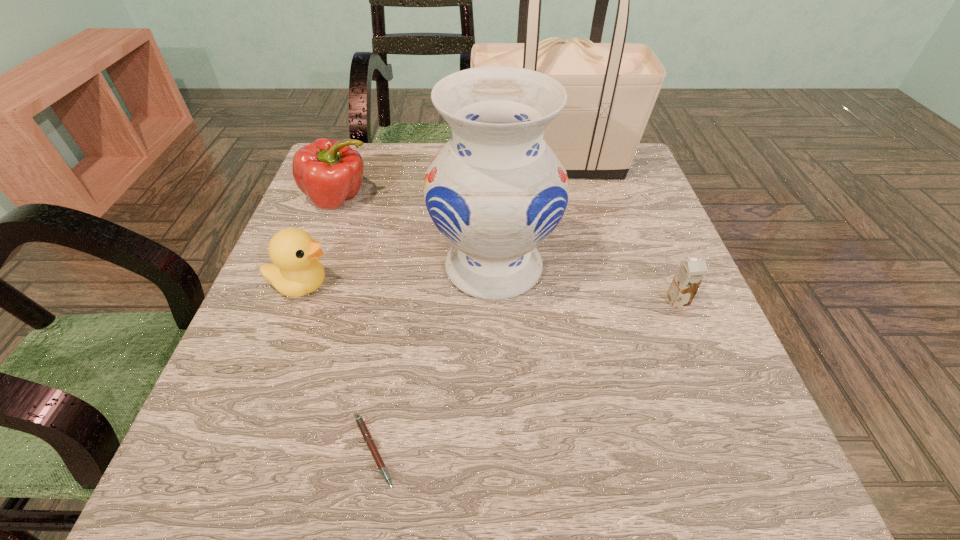
This screenshot has height=540, width=960. I want to click on vacant point located 0.240m on the back of the vase, so click(x=491, y=168).

At what (x,y) coordinates should I click in order to perform the action: click on free space located on the right of the pepper. Please return your answer as a coordinate pair (x, y). This screenshot has height=540, width=960. Looking at the image, I should click on (473, 199).

Where is `free space located 0.310m on the face of the third shortest object`? Image resolution: width=960 pixels, height=540 pixels. free space located 0.310m on the face of the third shortest object is located at coordinates (493, 285).

Locate an element on the screen. The height and width of the screenshot is (540, 960). vacant area situated on the left of the fifth tallest object is located at coordinates (578, 301).

The height and width of the screenshot is (540, 960). I want to click on vacant point located at the nib of the third object from left to right, so click(565, 451).

Find the location of a particular element. This screenshot has height=540, width=960. shopping bag located at the far edge is located at coordinates (611, 88).

The width and height of the screenshot is (960, 540). I want to click on pepper that is positioned at the far edge, so click(329, 172).

This screenshot has height=540, width=960. Find the location of `object that is at the near edge`. object that is at the near edge is located at coordinates (362, 426).

Where is `pepper located at the left edge`? This screenshot has height=540, width=960. pepper located at the left edge is located at coordinates (329, 172).

The height and width of the screenshot is (540, 960). In order to click on duck present at the left edge in this screenshot , I will do `click(295, 271)`.